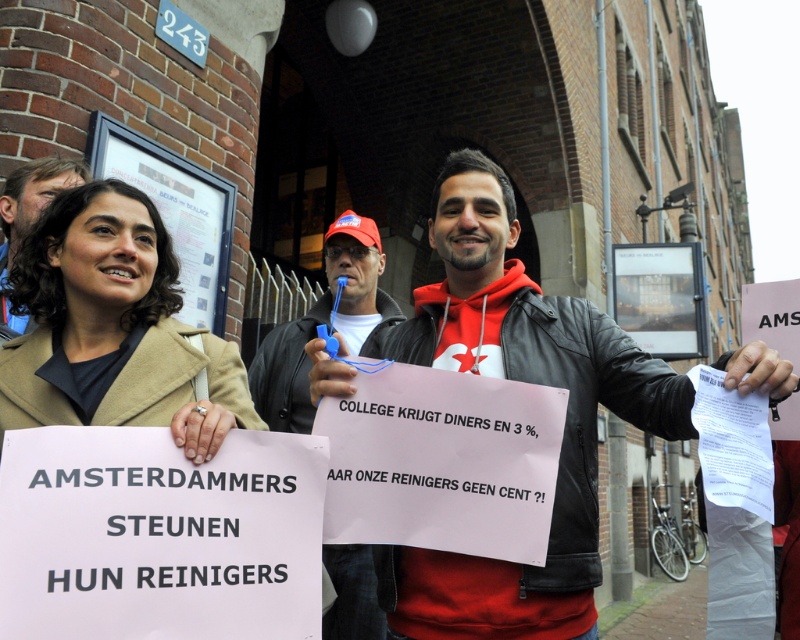
You are a photographer trying to capture both the beige wool coat at center and the matte black jacket at center in a single frame. Since you want to ensure both are fully visible, which clothing item should you focus on adjusting the camera angle for, considering their heights?

The beige wool coat at center has a lesser height compared to matte black jacket at center, so you should adjust the camera angle to focus on the shorter beige wool coat at center to ensure both are fully visible in the frame.

From the picture: You are a photographer trying to capture both the red leather jacket at center and the matte black jacket at upper left in a single frame. Based on their positions and sizes, which jacket should you focus on to ensure both are visible without cropping?

The red leather jacket at center is wider than the matte black jacket at upper left, so focusing on the red leather jacket at center will ensure both are visible without cropping since it occupies more space in the frame.

You are a photographer trying to capture both the beige wool coat at center and the matte black jacket at upper left in a single frame. Based on their positions and sizes, which one would appear larger in the photo?

The beige wool coat at center would appear larger in the photo because it is wider than the matte black jacket at upper left.